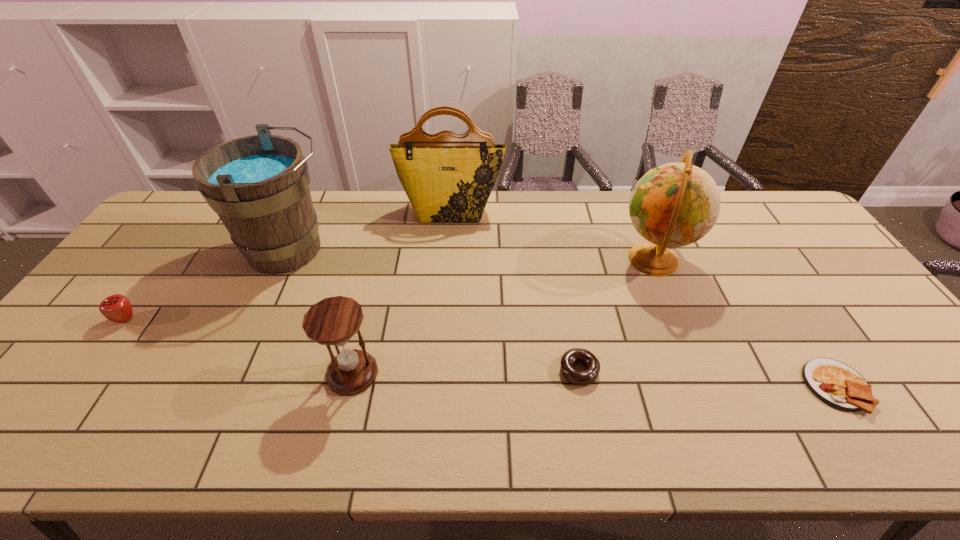
Identify the location of object positioned at the near edge. (836, 384).

The height and width of the screenshot is (540, 960). Identify the location of object that is at the left edge. (117, 308).

The height and width of the screenshot is (540, 960). I want to click on object located at the right edge, so click(x=836, y=384).

The width and height of the screenshot is (960, 540). Find the location of `object positioned at the near right corner`. object positioned at the near right corner is located at coordinates (836, 384).

You are a GUI agent. You are given a task and a screenshot of the screen. Output one action in this format:
    pyautogui.click(x=<x>, y=<y>)
    Task: Click on the vacant position at the far edge of the desktop
    
    Given the screenshot: What is the action you would take?
    [x=393, y=222]

Find the location of a particular element. The image size is (960, 540). blank space at the left edge of the desktop is located at coordinates (169, 260).

This screenshot has height=540, width=960. In the image, there is a desktop. Find the location of `vacant space at the right edge`. vacant space at the right edge is located at coordinates (804, 237).

Locate an element on the screen. This screenshot has width=960, height=540. vacant space at the far right corner of the desktop is located at coordinates (770, 225).

At what (x,y) coordinates should I click in order to perform the action: click on vacant area that lies between the sixth object from left to right and the hourglass. Please return your answer as a coordinate pair (x, y). This screenshot has height=540, width=960. Looking at the image, I should click on (503, 316).

At what (x,y) coordinates should I click in order to perform the action: click on empty location between the second object from right to left and the third shortest object. Please return your answer as a coordinate pair (x, y). This screenshot has height=540, width=960. Looking at the image, I should click on (390, 289).